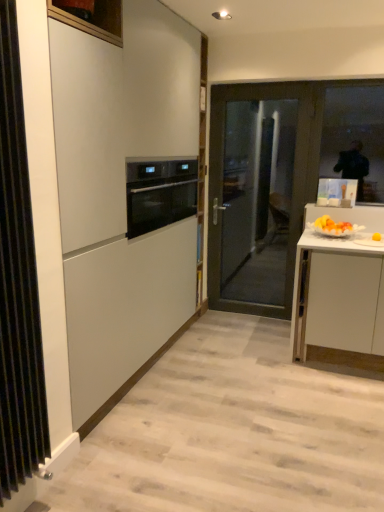
Question: From the image's perspective, is black metal radiator at left under transparent glass window at upper right?

Choices:
 (A) no
 (B) yes

Answer: (B)

Question: From a real-world perspective, is black metal radiator at left below transparent glass window at upper right?

Choices:
 (A) no
 (B) yes

Answer: (B)

Question: Is black metal radiator at left smaller than transparent glass window at upper right?

Choices:
 (A) yes
 (B) no

Answer: (B)

Question: From a real-world perspective, is black metal radiator at left on top of transparent glass window at upper right?

Choices:
 (A) no
 (B) yes

Answer: (A)

Question: Does black metal radiator at left have a greater height compared to transparent glass window at upper right?

Choices:
 (A) yes
 (B) no

Answer: (A)

Question: Is the surface of black metal radiator at left in direct contact with transparent glass window at upper right?

Choices:
 (A) yes
 (B) no

Answer: (B)

Question: Does transparent glass window at upper right lie behind dark gray glass door at center?

Choices:
 (A) yes
 (B) no

Answer: (B)

Question: Would you consider transparent glass window at upper right to be distant from dark gray glass door at center?

Choices:
 (A) yes
 (B) no

Answer: (B)

Question: Is transparent glass window at upper right at the left side of dark gray glass door at center?

Choices:
 (A) yes
 (B) no

Answer: (B)

Question: Considering the relative sizes of transparent glass window at upper right and dark gray glass door at center in the image provided, is transparent glass window at upper right wider than dark gray glass door at center?

Choices:
 (A) no
 (B) yes

Answer: (A)

Question: From a real-world perspective, does transparent glass window at upper right stand above dark gray glass door at center?

Choices:
 (A) yes
 (B) no

Answer: (A)

Question: From the image's perspective, would you say transparent glass window at upper right is shown under dark gray glass door at center?

Choices:
 (A) no
 (B) yes

Answer: (A)

Question: Can you confirm if matte white cabinet at center is smaller than dark gray glass door at center?

Choices:
 (A) no
 (B) yes

Answer: (A)